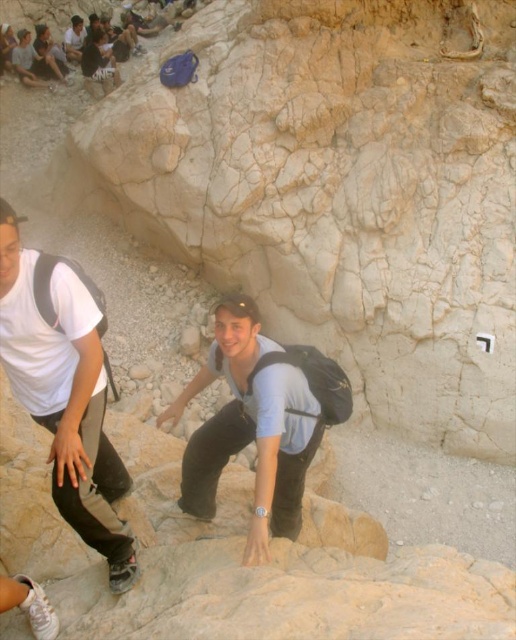
Question: Where is white matte shirt at upper left located in relation to matte black backpack at center in the image?

Choices:
 (A) left
 (B) right

Answer: (A)

Question: Is white matte shirt at upper left to the right of matte black backpack at center from the viewer's perspective?

Choices:
 (A) yes
 (B) no

Answer: (B)

Question: Which point appears closest to the camera in this image?

Choices:
 (A) (243, 381)
 (B) (18, 369)

Answer: (B)

Question: Is white matte shirt at upper left further to camera compared to matte black backpack at center?

Choices:
 (A) yes
 (B) no

Answer: (B)